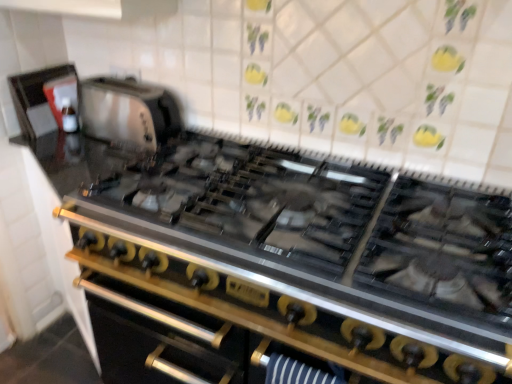
Question: Considering the relative sizes of matte black kettle at upper left, marked as the 2th appliance in a right-to-left arrangement, and satin silver toaster at upper left, which appears as the first appliance when viewed from the right, in the image provided, is matte black kettle at upper left, marked as the 2th appliance in a right-to-left arrangement, shorter than satin silver toaster at upper left, which appears as the first appliance when viewed from the right,?

Choices:
 (A) yes
 (B) no

Answer: (B)

Question: Does matte black kettle at upper left, which ranks as the 1th appliance in left-to-right order, come behind satin silver toaster at upper left, which appears as the first appliance when viewed from the right?

Choices:
 (A) yes
 (B) no

Answer: (A)

Question: Can satin silver toaster at upper left, which appears as the first appliance when viewed from the right, be found inside matte black kettle at upper left, which ranks as the 1th appliance in left-to-right order?

Choices:
 (A) no
 (B) yes

Answer: (A)

Question: Can you confirm if matte black kettle at upper left, which ranks as the 1th appliance in left-to-right order, is bigger than satin silver toaster at upper left, which is counted as the second appliance, starting from the left?

Choices:
 (A) no
 (B) yes

Answer: (A)

Question: Is matte black kettle at upper left, which ranks as the 1th appliance in left-to-right order, closer to camera compared to satin silver toaster at upper left, which is counted as the second appliance, starting from the left?

Choices:
 (A) no
 (B) yes

Answer: (A)

Question: From the image's perspective, relative to stainless steel oven at center, is matte black kettle at upper left, marked as the 2th appliance in a right-to-left arrangement, above or below?

Choices:
 (A) above
 (B) below

Answer: (A)

Question: From a real-world perspective, relative to stainless steel oven at center, is matte black kettle at upper left, marked as the 2th appliance in a right-to-left arrangement, vertically above or below?

Choices:
 (A) above
 (B) below

Answer: (A)

Question: Is matte black kettle at upper left, which ranks as the 1th appliance in left-to-right order, wider or thinner than stainless steel oven at center?

Choices:
 (A) thin
 (B) wide

Answer: (A)

Question: Is point (44, 117) positioned closer to the camera than point (206, 309)?

Choices:
 (A) closer
 (B) farther

Answer: (B)

Question: Looking at their shapes, would you say satin silver toaster at upper left, which is counted as the second appliance, starting from the left, is wider or thinner than stainless steel gas stove at center?

Choices:
 (A) wide
 (B) thin

Answer: (B)

Question: From a real-world perspective, is satin silver toaster at upper left, which is counted as the second appliance, starting from the left, positioned above or below stainless steel gas stove at center?

Choices:
 (A) below
 (B) above

Answer: (B)

Question: Does point (132, 140) appear closer or farther from the camera than point (308, 241)?

Choices:
 (A) closer
 (B) farther

Answer: (B)

Question: From the image's perspective, is satin silver toaster at upper left, which appears as the first appliance when viewed from the right, located above or below stainless steel gas stove at center?

Choices:
 (A) below
 (B) above

Answer: (B)

Question: Is satin silver toaster at upper left, which is counted as the second appliance, starting from the left, in front of or behind stainless steel oven at center in the image?

Choices:
 (A) front
 (B) behind

Answer: (B)

Question: Is satin silver toaster at upper left, which is counted as the second appliance, starting from the left, bigger or smaller than stainless steel oven at center?

Choices:
 (A) big
 (B) small

Answer: (B)